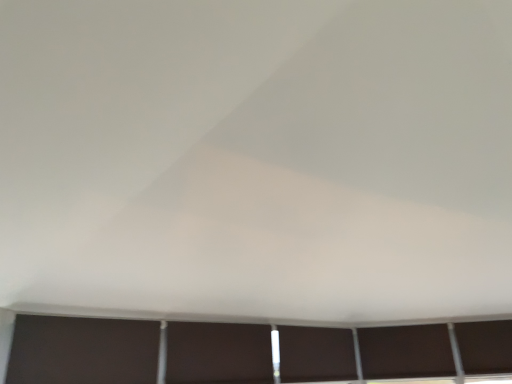
Question: Is dark matte window at lower right, which ranks as the 2th window in left-to-right order, outside dark brown matte window at lower right, placed as the 1th window when sorted from right to left?

Choices:
 (A) yes
 (B) no

Answer: (A)

Question: From the image's perspective, is dark matte window at lower right, which ranks as the 2th window in right-to-left order, below dark brown matte window at lower right, which is the 3th window from left to right?

Choices:
 (A) yes
 (B) no

Answer: (A)

Question: Does dark matte window at lower right, which ranks as the 2th window in right-to-left order, appear on the left side of dark brown matte window at lower right, placed as the 1th window when sorted from right to left?

Choices:
 (A) yes
 (B) no

Answer: (A)

Question: Considering the relative positions of dark matte window at lower right, which ranks as the 2th window in left-to-right order, and dark brown matte window at lower right, which is the 3th window from left to right, in the image provided, is dark matte window at lower right, which ranks as the 2th window in left-to-right order, behind dark brown matte window at lower right, which is the 3th window from left to right,?

Choices:
 (A) no
 (B) yes

Answer: (B)

Question: Can you confirm if dark matte window at lower right, which ranks as the 2th window in right-to-left order, is smaller than dark brown matte window at lower right, which is the 3th window from left to right?

Choices:
 (A) no
 (B) yes

Answer: (A)

Question: From a real-world perspective, is dark matte window at bottom, the first window from the left, above or below dark matte shutter at lower left, arranged as the second shutter when viewed from the back?

Choices:
 (A) above
 (B) below

Answer: (B)

Question: Is point (293, 374) positioned closer to the camera than point (91, 370)?

Choices:
 (A) closer
 (B) farther

Answer: (B)

Question: In the image, is dark matte window at bottom, the first window from the left, positioned in front of or behind dark matte shutter at lower left, which appears as the 2th shutter when viewed from the right?

Choices:
 (A) front
 (B) behind

Answer: (B)

Question: From the image's perspective, is dark matte window at bottom, positioned as the 3th window in right-to-left order, positioned above or below dark matte shutter at lower left, arranged as the second shutter when viewed from the back?

Choices:
 (A) above
 (B) below

Answer: (B)

Question: Relative to matte brown shutter at center, which appears as the 2th shutter when viewed from the front, is dark brown matte window at lower right, which is the 3th window from left to right, in front or behind?

Choices:
 (A) front
 (B) behind

Answer: (B)

Question: Looking at their shapes, would you say dark brown matte window at lower right, placed as the 1th window when sorted from right to left, is wider or thinner than matte brown shutter at center, the 2th shutter from the left?

Choices:
 (A) thin
 (B) wide

Answer: (A)

Question: Would you say dark brown matte window at lower right, which is the 3th window from left to right, is to the left or to the right of matte brown shutter at center, the 2th shutter from the left, in the picture?

Choices:
 (A) right
 (B) left

Answer: (A)

Question: From the image's perspective, is dark brown matte window at lower right, placed as the 1th window when sorted from right to left, above or below matte brown shutter at center, the 1th shutter in the right-to-left sequence?

Choices:
 (A) below
 (B) above

Answer: (A)

Question: Is dark matte window at lower right, which ranks as the 2th window in left-to-right order, inside or outside of dark matte window at bottom, the first window from the left?

Choices:
 (A) inside
 (B) outside

Answer: (B)

Question: In terms of height, does dark matte window at lower right, which ranks as the 2th window in left-to-right order, look taller or shorter compared to dark matte window at bottom, the first window from the left?

Choices:
 (A) short
 (B) tall

Answer: (B)